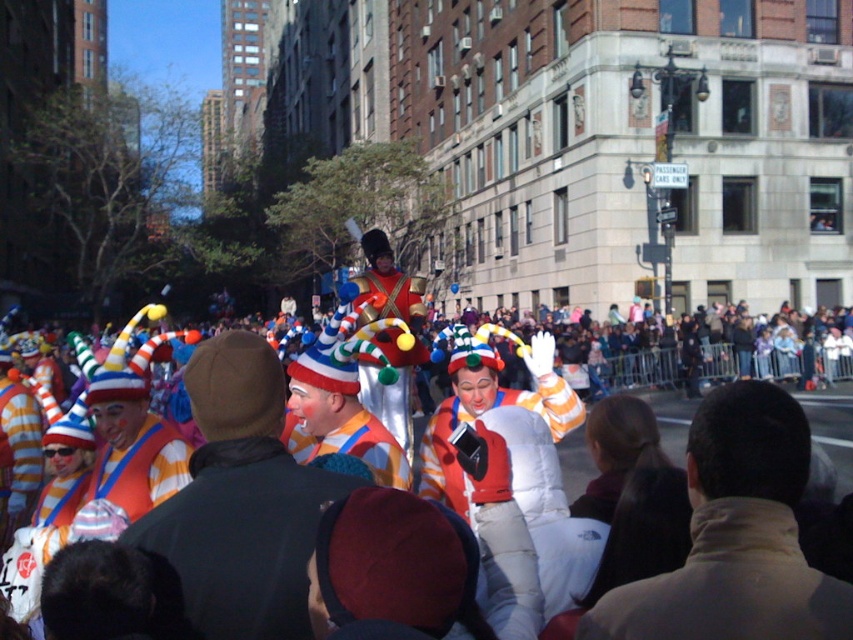
Question: Based on their relative distances, which object is farther from the matte clown costume at center?

Choices:
 (A) matte orange and white striped costume at center
 (B) matte white clown at center

Answer: (B)

Question: Does light brown jacket at center have a lesser width compared to matte orange and white striped costume at center?

Choices:
 (A) yes
 (B) no

Answer: (B)

Question: Which point appears closest to the camera in this image?

Choices:
 (A) (434, 440)
 (B) (210, 426)

Answer: (B)

Question: Is matte white balloon at center thinner than matte clown costume at center?

Choices:
 (A) yes
 (B) no

Answer: (B)

Question: Can you confirm if matte white balloon at center is positioned to the left of matte clown costume at center?

Choices:
 (A) no
 (B) yes

Answer: (A)

Question: Which object is the farthest from the light brown jacket at center?

Choices:
 (A) matte orange and white striped costume at center
 (B) matte white clown at center

Answer: (A)